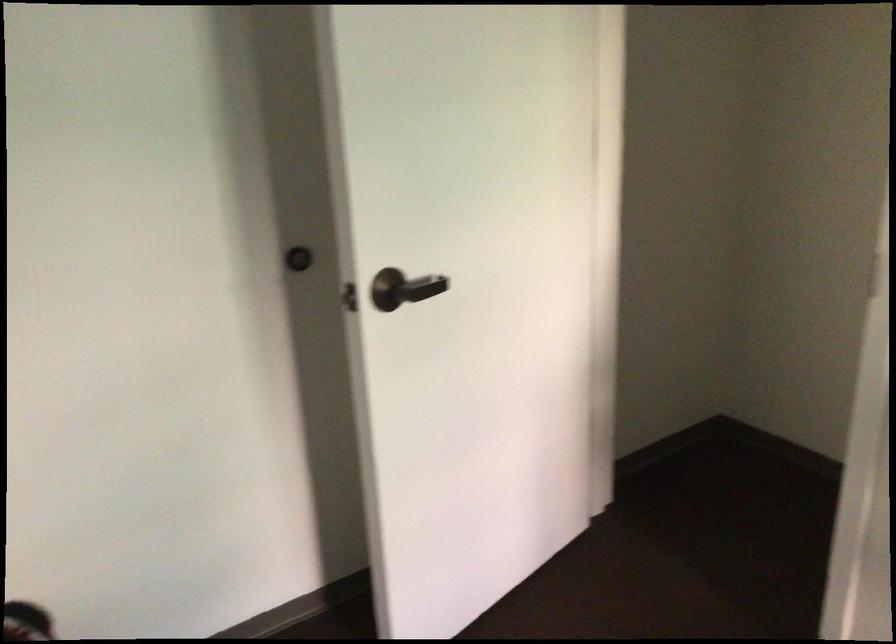
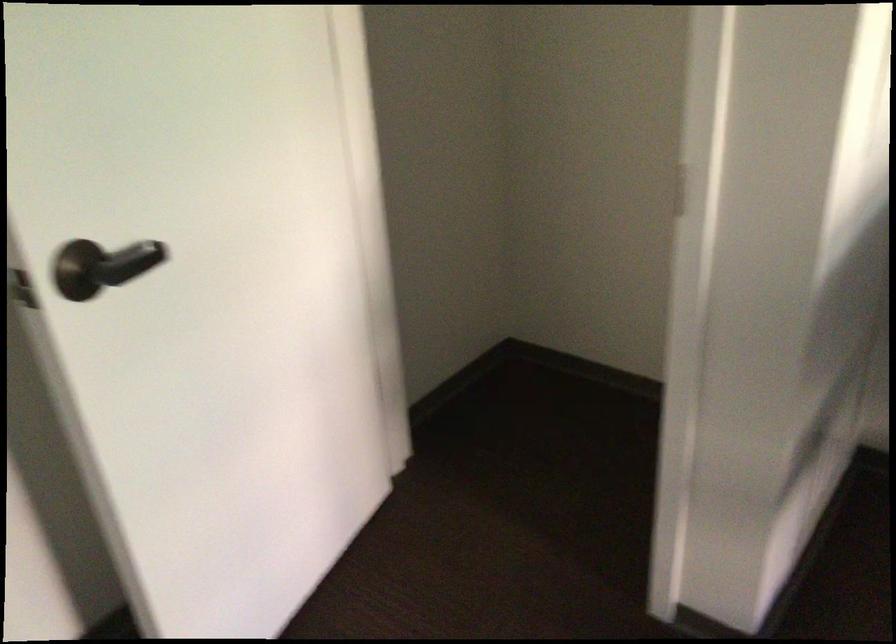
Question: The images are taken continuously from a first-person perspective. In which direction is your viewpoint rotating?

Choices:
 (A) Left
 (B) Right
 (C) Up
 (D) Down

Answer: (B)